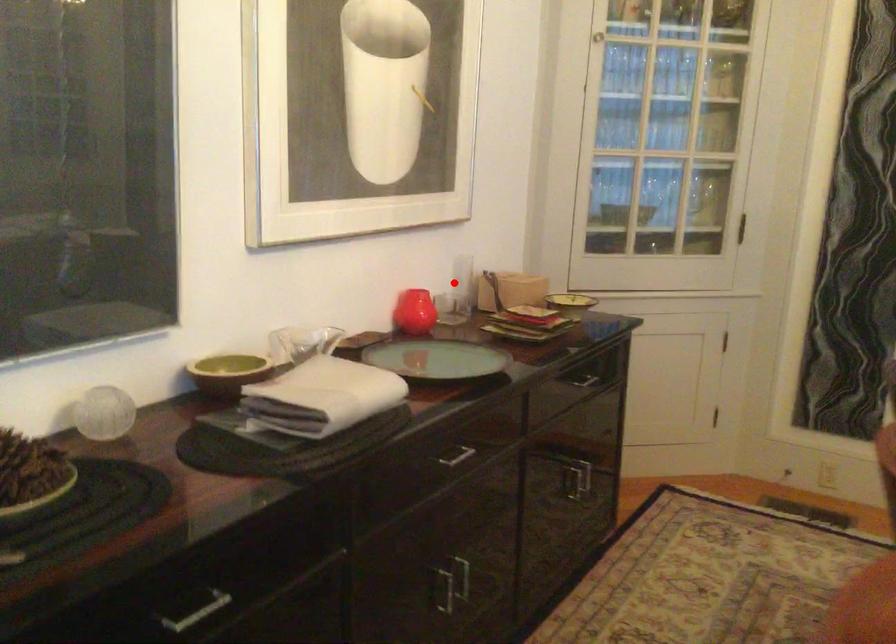
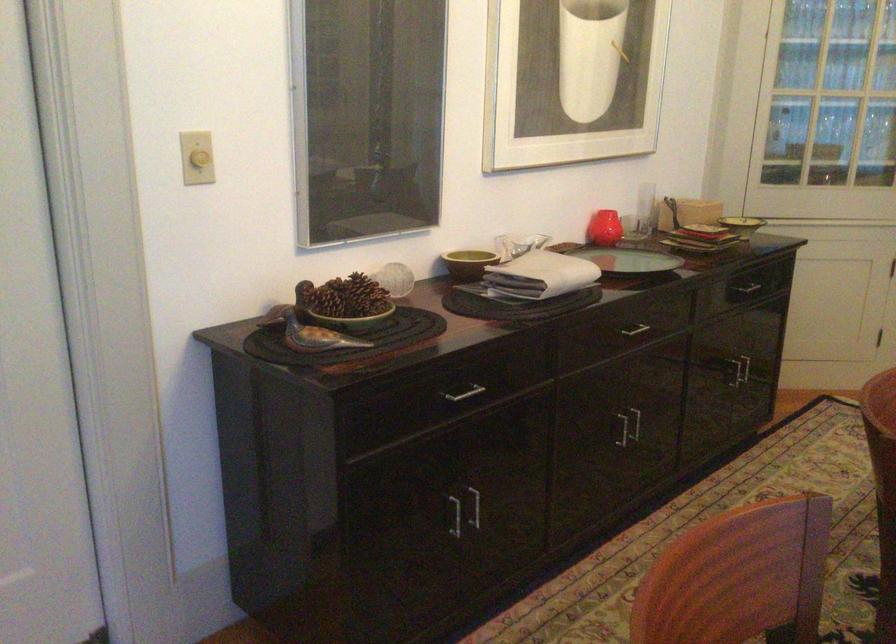
Question: I am providing you with two images of the same scene from different viewpoints. Image1 has a red point marked. In image2, the corresponding 3D location appears at what relative position? Reply with the corresponding letter.

Choices:
 (A) Closer
 (B) Farther

Answer: (B)